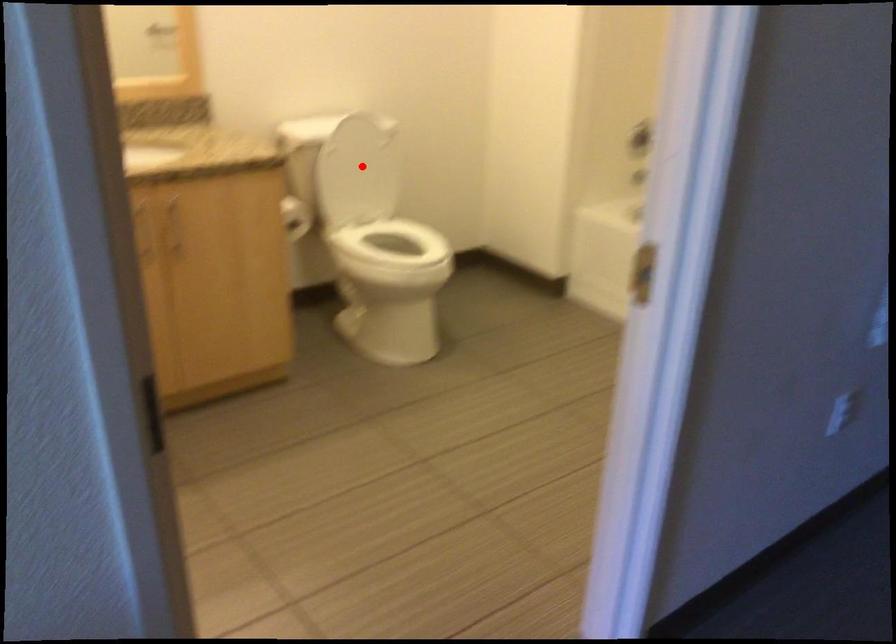
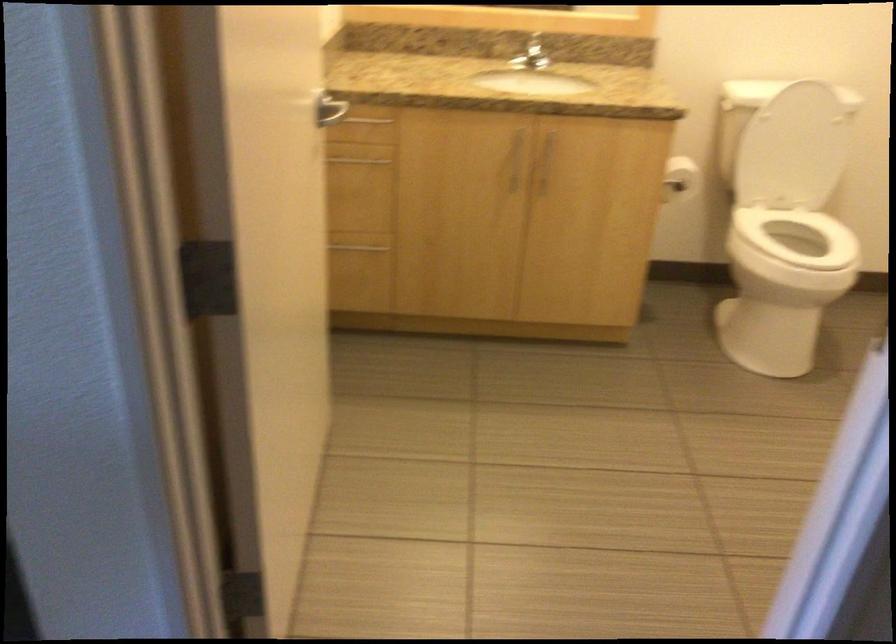
Question: I am providing you with two images of the same scene from different viewpoints. In image1, a red point is highlighted. Considering the same 3D point in image2, which of the following is correct?

Choices:
 (A) It is closer
 (B) It is farther

Answer: (A)